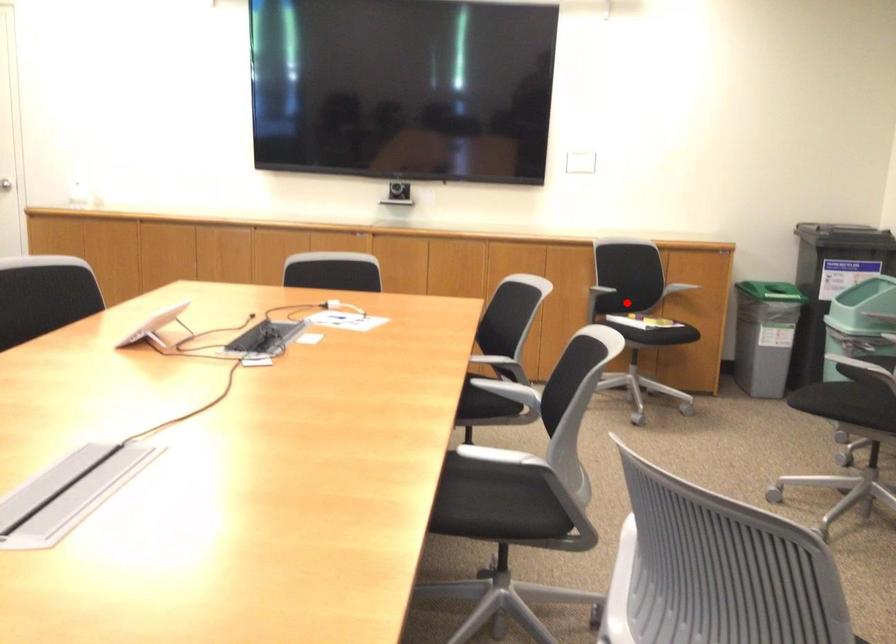
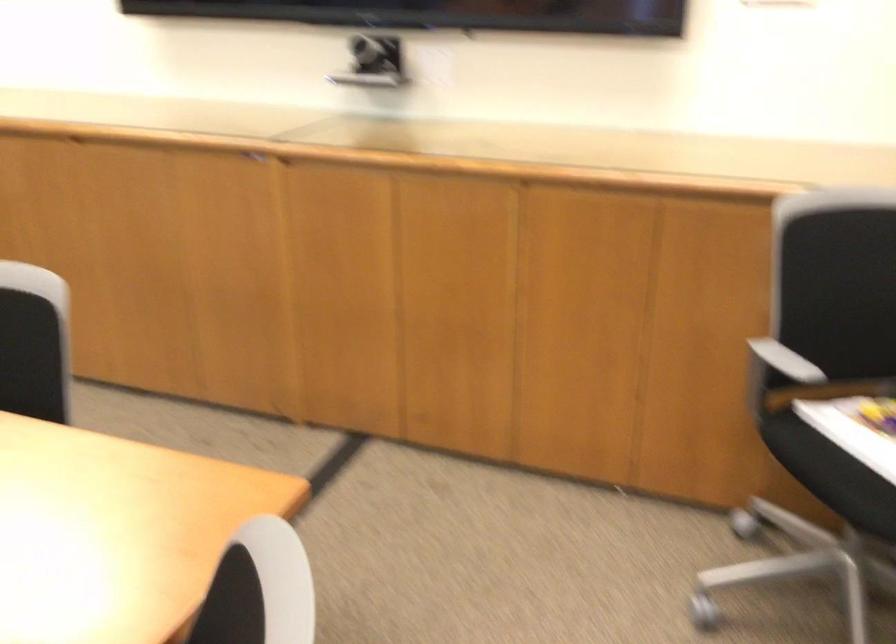
Where in the second image is the point corresponding to the highlighted location from the first image?

(857, 442)